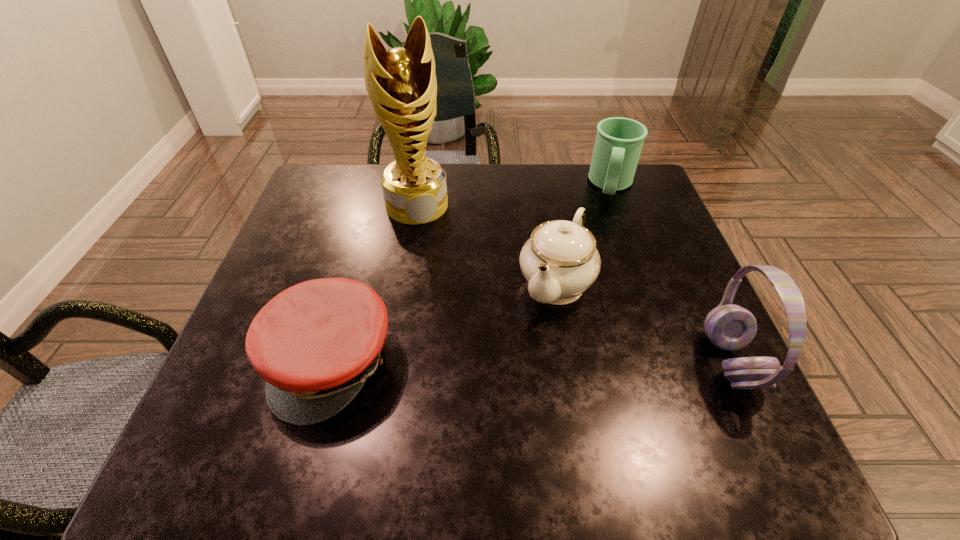
You are a GUI agent. You are given a task and a screenshot of the screen. Output one action in this format:
    pyautogui.click(x=<x>, y=<y>)
    Task: Click on the shortest object
    This screenshot has height=540, width=960.
    Given the screenshot: What is the action you would take?
    pyautogui.click(x=316, y=343)

Locate an element on the screen. The image size is (960, 540). headset is located at coordinates (730, 327).

You are a GUI agent. You are given a task and a screenshot of the screen. Output one action in this format:
    pyautogui.click(x=<x>, y=<y>)
    Task: Click on the mug
    The image size is (960, 540).
    Given the screenshot: What is the action you would take?
    pyautogui.click(x=619, y=141)

Locate an element on the screen. the tallest object is located at coordinates (401, 83).

Where is `the third object from right to left`? The height and width of the screenshot is (540, 960). the third object from right to left is located at coordinates (560, 261).

Find the location of a particular element. This screenshot has width=960, height=540. free space located on the headband and ear cups of the fourth shortest object is located at coordinates [634, 362].

You are a GUI agent. You are given a task and a screenshot of the screen. Output one action in this format:
    pyautogui.click(x=<x>, y=<y>)
    Task: Click on the blank area located on the headband and ear cups of the fourth shortest object
    This screenshot has width=960, height=540.
    Given the screenshot: What is the action you would take?
    pyautogui.click(x=539, y=362)

You are a GUI agent. You are given a task and a screenshot of the screen. Output one action in this format:
    pyautogui.click(x=<x>, y=<y>)
    Task: Click on the blank area located 0.370m on the headband and ear cups of the fourth shortest object
    This screenshot has width=960, height=540.
    Given the screenshot: What is the action you would take?
    point(513,362)

This screenshot has width=960, height=540. I want to click on vacant area situated on the side of the mug with the handle, so [605, 257].

Where is `blank space located on the side of the mug with the handle`? The width and height of the screenshot is (960, 540). blank space located on the side of the mug with the handle is located at coordinates (597, 314).